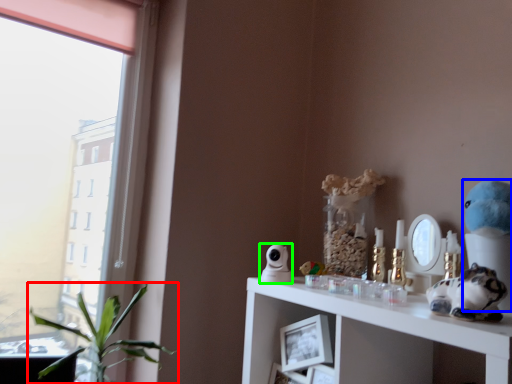
Question: Estimate the real-world distances between objects in this image. Which object is farther from houseplant (highlighted by a red box), figurine (highlighted by a blue box) or figurine (highlighted by a green box)?

Choices:
 (A) figurine
 (B) figurine

Answer: (A)